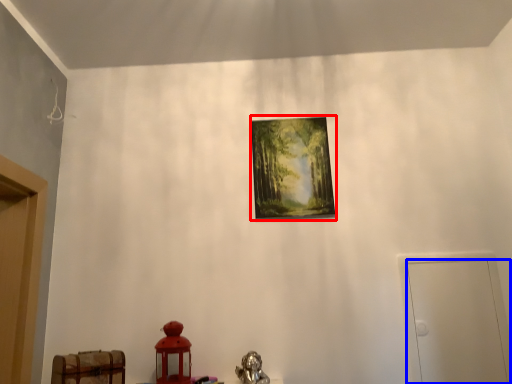
Question: Which point is further to the camera, picture frame (highlighted by a red box) or door (highlighted by a blue box)?

Choices:
 (A) picture frame
 (B) door

Answer: (A)